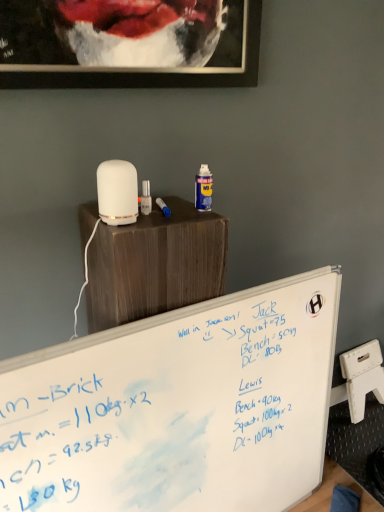
What do you see at coordinates (129, 42) in the screenshot? Image resolution: width=384 pixels, height=512 pixels. I see `black matte picture frame at upper center` at bounding box center [129, 42].

The height and width of the screenshot is (512, 384). Identify the location of black matte picture frame at upper center. (129, 42).

This screenshot has width=384, height=512. Identify the location of black matte picture frame at upper center. (129, 42).